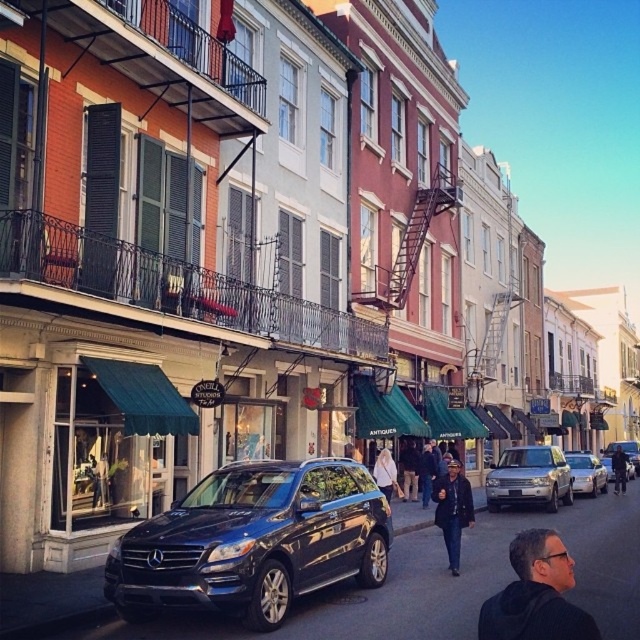
You are a delivery person standing on the street in front of the shops with green awnings. You need to place a package on the ground between the dark blue hoodie at lower right and the dark blue leather jacket at center. Will the package fit between them if it requires 1 meter of space?

The dark blue hoodie at lower right is not as tall as the dark blue leather jacket at center, but the description does not provide information about the horizontal distance between them. Therefore, it is impossible to determine if the package will fit based on the given details.

You are a tourist walking down this historic street and notice two dark blue items of clothing. The dark blue hoodie at lower right and the dark blue leather jacket at center. Which one is positioned more to the left side of the street?

The dark blue hoodie at lower right is positioned more to the left side of the street than the dark blue leather jacket at center.